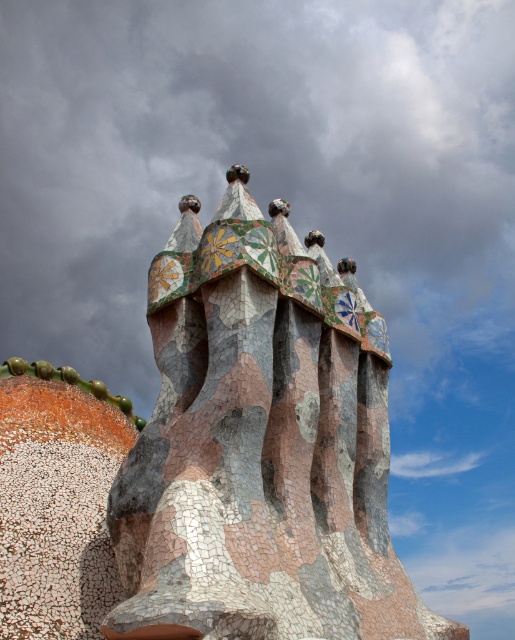
You are an architect designing a new building and want to incorporate elements from this image. If the height of the mosaic tile spires at center in the image is 30 meters, what would be the height of the cloudy sky at upper center in your scaled model if you use a scale of 1 cm to 10 meters?

The cloudy sky at upper center is 63.20 meters away from the mosaic tile spires at center. Since the spires are 30 meters tall, the total height from the base to the sky would be 30 meters plus 63.20 meters, totaling 93.20 meters. Using the scale of 1 cm to 10 meters, the model height would be 93.20 divided by 10, which equals 9.32 centimeters.

You are an architect analyzing the building design in the image. Which object, the cloudy sky at upper center or the mosaic tile spires at center, is positioned higher in the scene?

The cloudy sky at upper center is positioned higher than the mosaic tile spires at center in the scene.

Looking at this image, you are an architect analyzing the structure of the building. Based on the image, which object is located to the right of the other between the cloudy sky at upper center and the mosaic tile spires at center?

The cloudy sky at upper center is positioned on the right side of the mosaic tile spires at center.